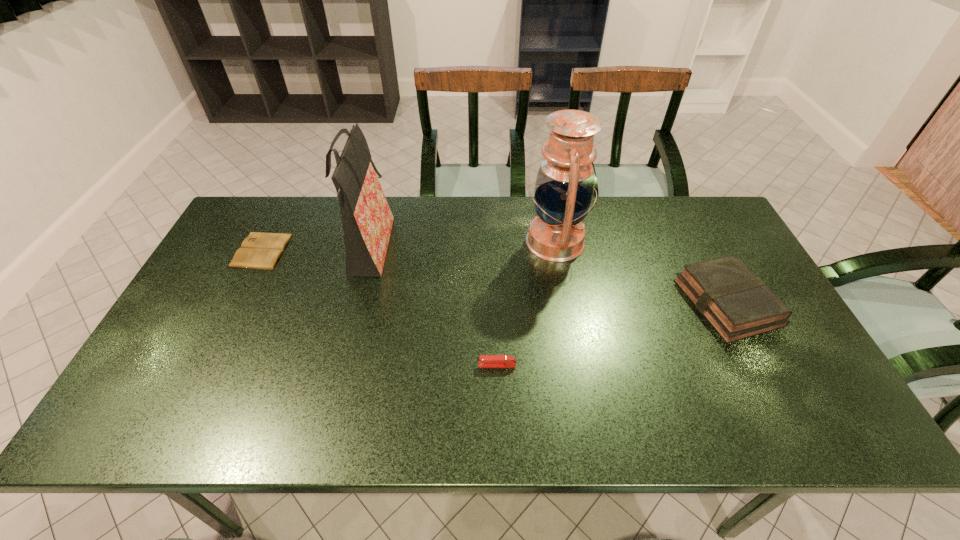
This screenshot has width=960, height=540. Identify the location of the second object from right to left. (564, 187).

Locate an element on the screen. Image resolution: width=960 pixels, height=540 pixels. the second object from left to right is located at coordinates (367, 220).

Image resolution: width=960 pixels, height=540 pixels. I want to click on the taller book, so [734, 300].

You are a GUI agent. You are given a task and a screenshot of the screen. Output one action in this format:
    pyautogui.click(x=<x>, y=<y>)
    Task: Click on the third tallest object
    The width and height of the screenshot is (960, 540).
    Given the screenshot: What is the action you would take?
    pyautogui.click(x=734, y=300)

Locate an element on the screen. The height and width of the screenshot is (540, 960). stapler is located at coordinates (485, 361).

At what (x,y) coordinates should I click in order to perform the action: click on the second shortest object. Please return your answer as a coordinate pair (x, y). This screenshot has height=540, width=960. Looking at the image, I should click on (485, 361).

I want to click on the shortest object, so click(x=262, y=251).

Where is `the shorter book`? This screenshot has height=540, width=960. the shorter book is located at coordinates (262, 251).

You are a GUI agent. You are given a task and a screenshot of the screen. Output one action in this format:
    pyautogui.click(x=<x>, y=<y>)
    Task: Click on the free space located on the left of the second object from right to left
    
    Given the screenshot: What is the action you would take?
    pyautogui.click(x=481, y=242)

This screenshot has width=960, height=540. I want to click on vacant space located 0.140m on the front side of the shopping bag, so click(x=438, y=249).